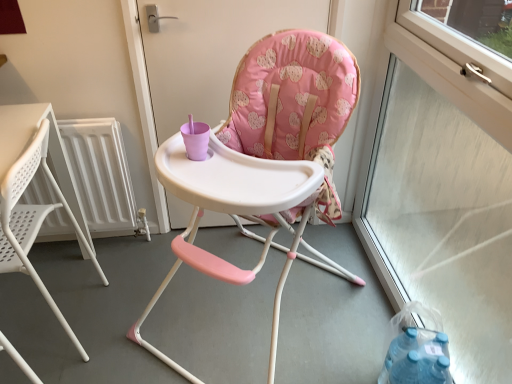
I want to click on vacant area that lies between pink fabric high chair at center and transparent glass window at right, so click(x=316, y=294).